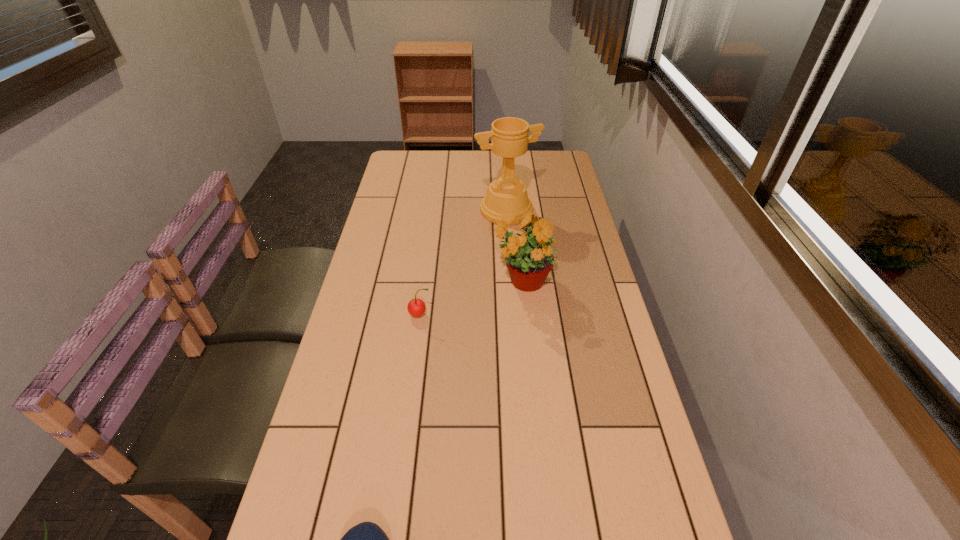
What are the coordinates of `the tallest object` in the screenshot? It's located at (507, 197).

This screenshot has width=960, height=540. In order to click on the farthest object in this screenshot , I will do `click(507, 197)`.

You are a GUI agent. You are given a task and a screenshot of the screen. Output one action in this format:
    pyautogui.click(x=<x>, y=<y>)
    Task: Click on the second farthest object
    The image size is (960, 540).
    Given the screenshot: What is the action you would take?
    pyautogui.click(x=528, y=256)

Identify the location of flowerpot. The height and width of the screenshot is (540, 960). (528, 256).

Locate an element on the screen. This screenshot has height=540, width=960. the third farthest object is located at coordinates [x=416, y=307].

I want to click on the third tallest object, so click(x=416, y=307).

This screenshot has width=960, height=540. I want to click on vacant space situated 0.180m on the front of the award, so click(510, 259).

This screenshot has width=960, height=540. In order to click on vacant area located 0.180m on the front of the third shortest object in this screenshot , I will do `click(530, 359)`.

At what (x,y) coordinates should I click in order to perform the action: click on free space located on the right of the second shortest object. Please return your answer as a coordinate pair (x, y). Looking at the image, I should click on (513, 314).

You are a GUI agent. You are given a task and a screenshot of the screen. Output one action in this format:
    pyautogui.click(x=<x>, y=<y>)
    Task: Click on the object that is at the right edge
    
    Given the screenshot: What is the action you would take?
    pyautogui.click(x=528, y=256)